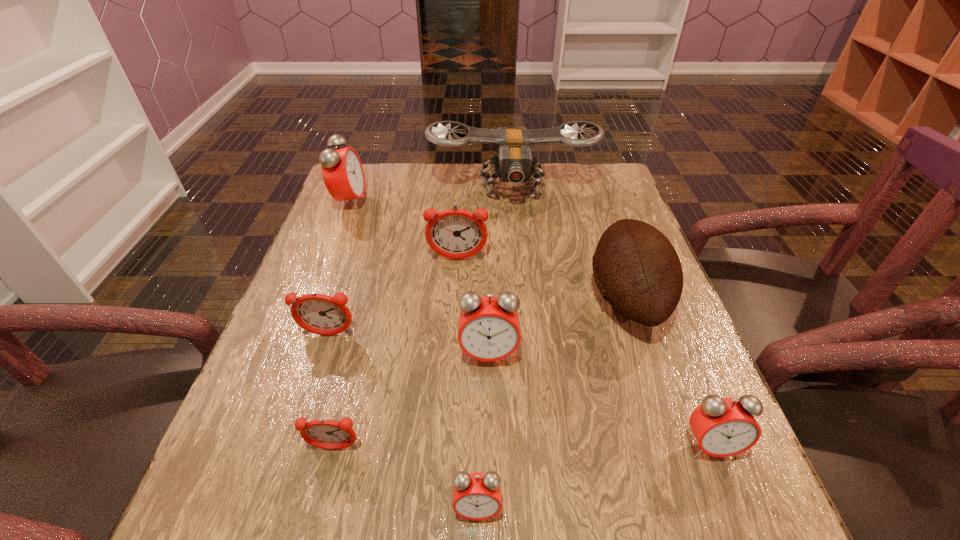
I want to click on drone, so click(x=514, y=163).

Find the location of a particular element. This screenshot has width=960, height=540. the leftmost red alarm clock is located at coordinates (342, 171).

Where is `the farthest alarm clock`? The width and height of the screenshot is (960, 540). the farthest alarm clock is located at coordinates (342, 171).

Identify the location of brown football. (636, 268).

The width and height of the screenshot is (960, 540). In order to click on the farthest reddish-pink alarm clock in this screenshot , I will do `click(454, 233)`.

The image size is (960, 540). Find the location of `the biggest reddish-pink alarm clock`. the biggest reddish-pink alarm clock is located at coordinates (454, 233).

The height and width of the screenshot is (540, 960). I want to click on the third nearest red alarm clock, so click(488, 329).

This screenshot has height=540, width=960. I want to click on the second smallest reddish-pink alarm clock, so click(x=321, y=314).

Identify the location of the rightmost red alarm clock. The image size is (960, 540). (723, 427).

In order to click on the rightmost alarm clock in this screenshot , I will do `click(723, 427)`.